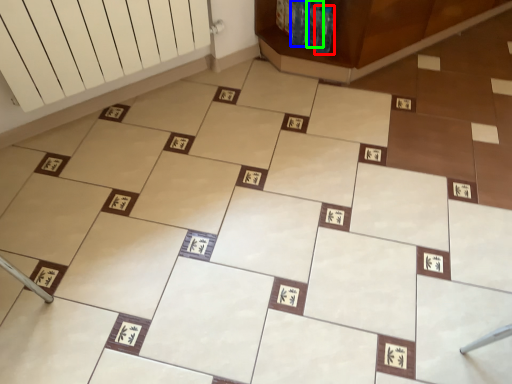
Question: Which object is positioned closest to bottle (highlighted by a red box)? Select from bottle (highlighted by a blue box) and bottle (highlighted by a green box).

Choices:
 (A) bottle
 (B) bottle

Answer: (B)